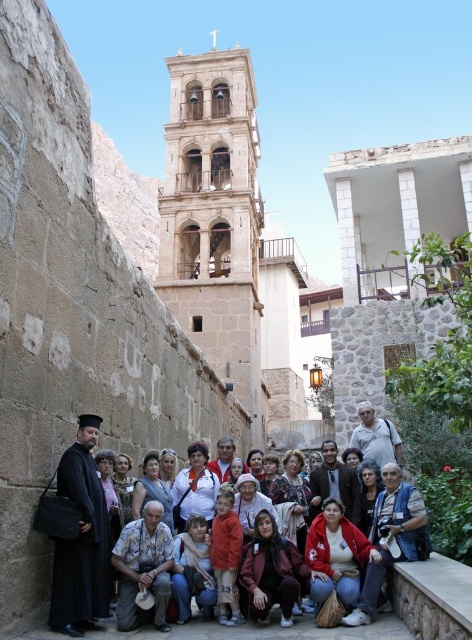
Does dark brown leather jacket at center have a lesser width compared to black matte robe at left?

In fact, dark brown leather jacket at center might be wider than black matte robe at left.

What do you see at coordinates (101, 545) in the screenshot? I see `dark brown leather jacket at center` at bounding box center [101, 545].

The width and height of the screenshot is (472, 640). I want to click on dark brown leather jacket at center, so click(101, 545).

Can you confirm if black matte robe at left is positioned to the right of dark red fabric robe at center?

In fact, black matte robe at left is to the left of dark red fabric robe at center.

Does black matte robe at left appear over dark red fabric robe at center?

Incorrect, black matte robe at left is not positioned above dark red fabric robe at center.

What do you see at coordinates (81, 544) in the screenshot?
I see `black matte robe at left` at bounding box center [81, 544].

I want to click on black matte robe at left, so click(x=81, y=544).

Is dark brown leather jacket at center positioned before dark red fabric robe at center?

Yes, dark brown leather jacket at center is closer to the viewer.

Can you confirm if dark brown leather jacket at center is taller than dark red fabric robe at center?

Yes, dark brown leather jacket at center is taller than dark red fabric robe at center.

Which is behind, point (55, 609) or point (344, 476)?

Point (344, 476)

The width and height of the screenshot is (472, 640). What are the coordinates of `dark brown leather jacket at center` in the screenshot? It's located at (101, 545).